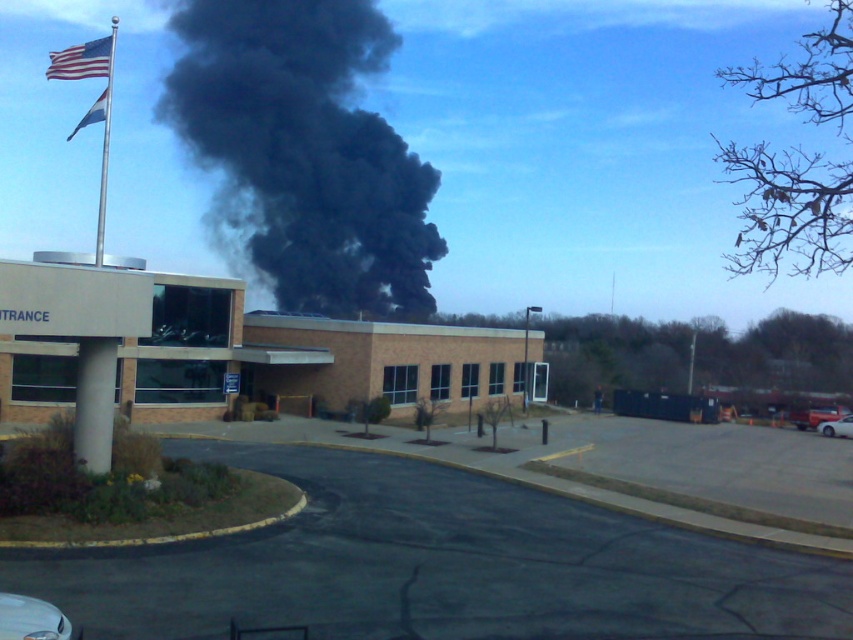
Which is behind, point (291, 0) or point (102, 76)?

Point (291, 0)

Does black smoke at upper center have a smaller size compared to american flag at upper left?

Yes.

Where is `black smoke at upper center`? The height and width of the screenshot is (640, 853). black smoke at upper center is located at coordinates (303, 152).